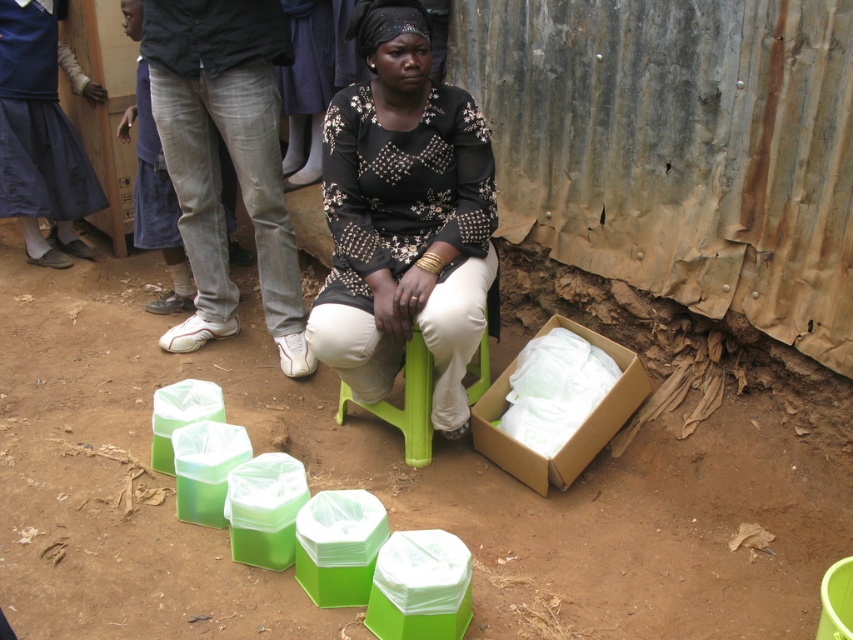
Question: Can you confirm if black sheer blouse at center is smaller than brown cardboard box at lower right?

Choices:
 (A) yes
 (B) no

Answer: (B)

Question: From the image, what is the correct spatial relationship of black sheer blouse at center in relation to brown cardboard box at lower right?

Choices:
 (A) left
 (B) right

Answer: (A)

Question: Which object is closer to the camera taking this photo?

Choices:
 (A) blue fabric skirt at lower left
 (B) brown cardboard box at lower right
 (C) black sheer blouse at center

Answer: (C)

Question: Is black sheer blouse at center positioned before brown cardboard box at lower right?

Choices:
 (A) yes
 (B) no

Answer: (A)

Question: Estimate the real-world distances between objects in this image. Which object is closer to the brown cardboard box at lower right?

Choices:
 (A) blue fabric skirt at lower left
 (B) black sheer blouse at center

Answer: (B)

Question: Which object is the closest to the black sheer blouse at center?

Choices:
 (A) brown cardboard box at lower right
 (B) blue fabric skirt at lower left

Answer: (A)